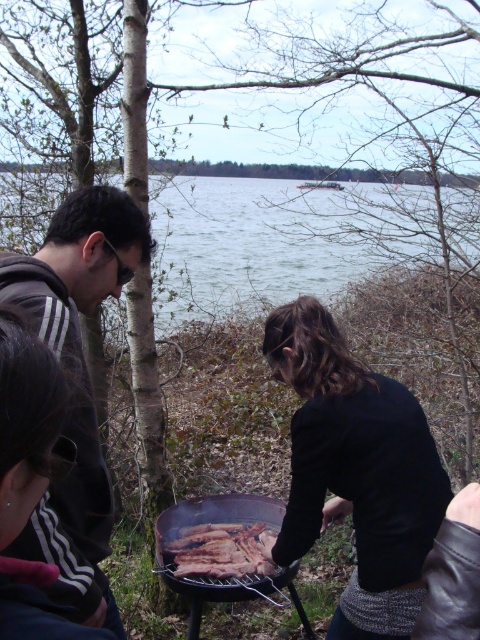
Question: Is dark gray hoodie at left bigger than grilled meat at center?

Choices:
 (A) yes
 (B) no

Answer: (A)

Question: Which of the following is the closest to the observer?

Choices:
 (A) (254, 560)
 (B) (29, 301)

Answer: (B)

Question: Can you confirm if green water at center is wider than grilled meat at center?

Choices:
 (A) yes
 (B) no

Answer: (A)

Question: Considering the real-world distances, which object is farthest from the dark gray sweater at center?

Choices:
 (A) green water at center
 (B) grilled meat at center
 (C) dark gray hoodie at left

Answer: (A)

Question: Is dark gray sweater at center bigger than dark gray hoodie at left?

Choices:
 (A) yes
 (B) no

Answer: (A)

Question: Estimate the real-world distances between objects in this image. Which object is farther from the dark gray hoodie at left?

Choices:
 (A) green water at center
 (B) grilled meat at center
 (C) dark gray sweater at center

Answer: (A)